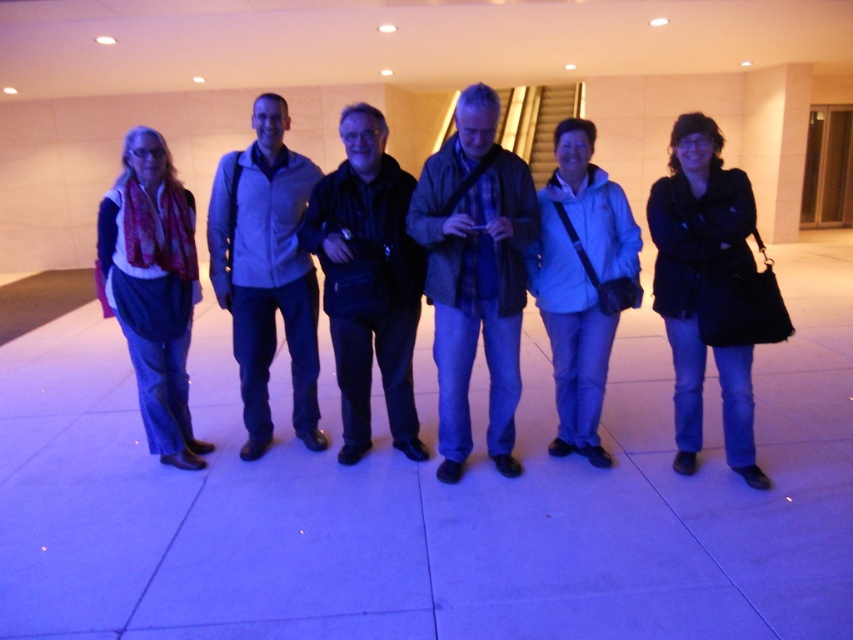
Question: Is black leather jacket at center thinner than dark blue leather jacket at center?

Choices:
 (A) no
 (B) yes

Answer: (B)

Question: Is blue plaid shirt at center smaller than black leather jacket at center?

Choices:
 (A) no
 (B) yes

Answer: (A)

Question: Can you confirm if black leather jacket at center is positioned above dark blue leather jacket at center?

Choices:
 (A) yes
 (B) no

Answer: (B)

Question: Which object is farther from the camera taking this photo?

Choices:
 (A) black leather jacket at center
 (B) dark blue leather jacket at center
 (C) white matte jacket at center
 (D) blue plaid shirt at center

Answer: (C)

Question: Which point appears closest to the camera in this image?

Choices:
 (A) (381, 312)
 (B) (614, 310)
 (C) (238, 321)
 (D) (119, 177)

Answer: (B)

Question: Which point appears farthest from the camera in this image?

Choices:
 (A) (699, 362)
 (B) (548, 448)
 (C) (186, 273)
 (D) (492, 131)

Answer: (B)